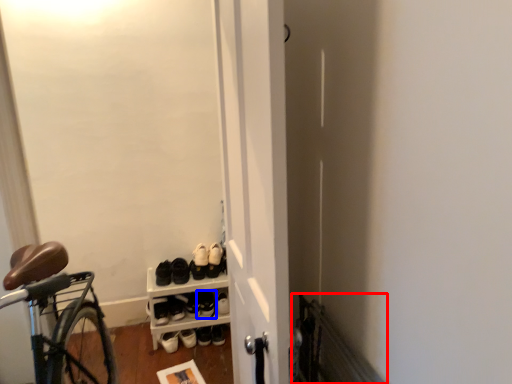
Question: Which object appears farthest to the camera in this image, radiator (highlighted by a red box) or footwear (highlighted by a blue box)?

Choices:
 (A) radiator
 (B) footwear

Answer: (B)